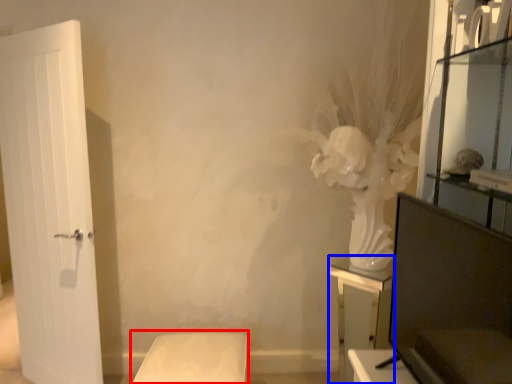
Question: Which point is further to the camera, furniture (highlighted by a red box) or furniture (highlighted by a blue box)?

Choices:
 (A) furniture
 (B) furniture

Answer: (B)